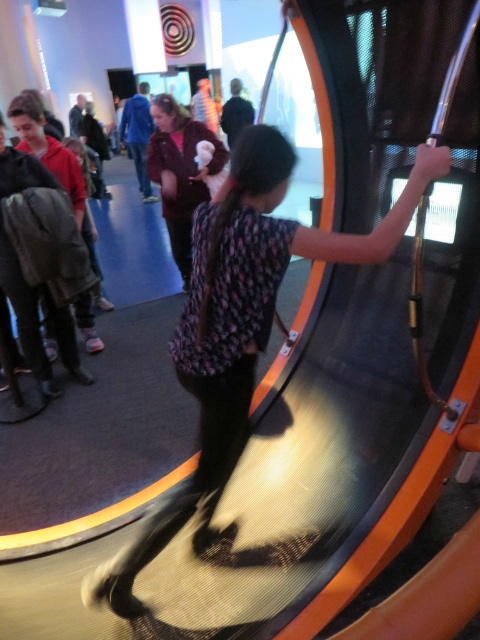
You are standing in the science museum exhibit and notice two points marked in the image. The first point is at coordinate [206,492] and the second is at [183,227]. Which point is closer to your viewpoint?

Point [206,492] is closer to the camera than point [183,227].

You are a museum guide who needs to move from the patterned fabric dress at center to the velvet brown coat at center. The museum has a strict rule that you must maintain a minimum distance of 2 meters between visitors. Can you safely walk directly between them without violating the rule?

The patterned fabric dress at center is 2.60 meters from the velvet brown coat at center, so yes, you can safely walk directly between them without violating the 2 meter rule since the distance is sufficient.

You are standing in the science museum and want to take a photo of the patterned fabric dress at center without getting too close. If your camera has a maximum focus range of 1.5 meters, will you be able to capture a clear photo from your current position?

The patterned fabric dress at center is 1.34 meters away from the viewer, which is within the camera maximum focus range of 1.5 meters. Therefore, you can capture a clear photo from your current position.